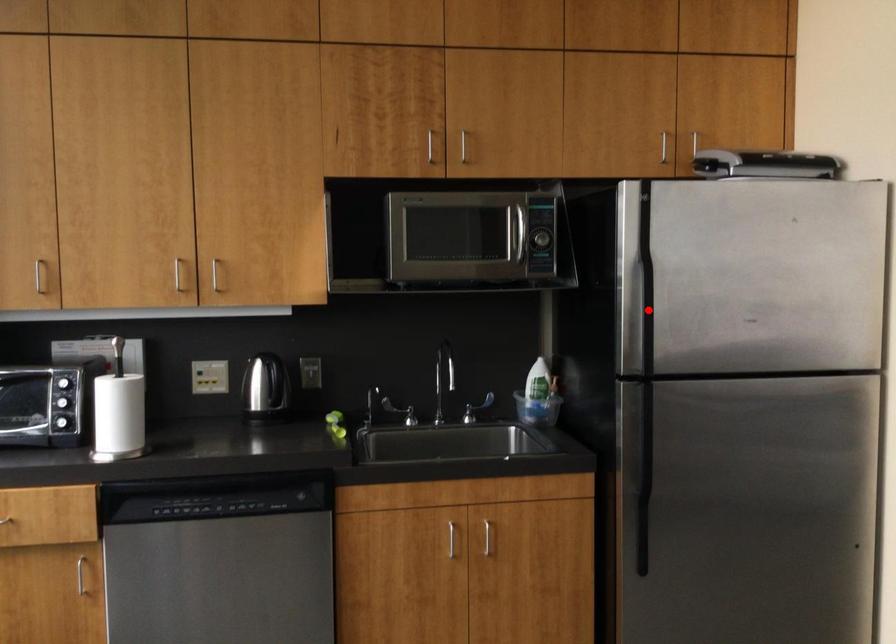
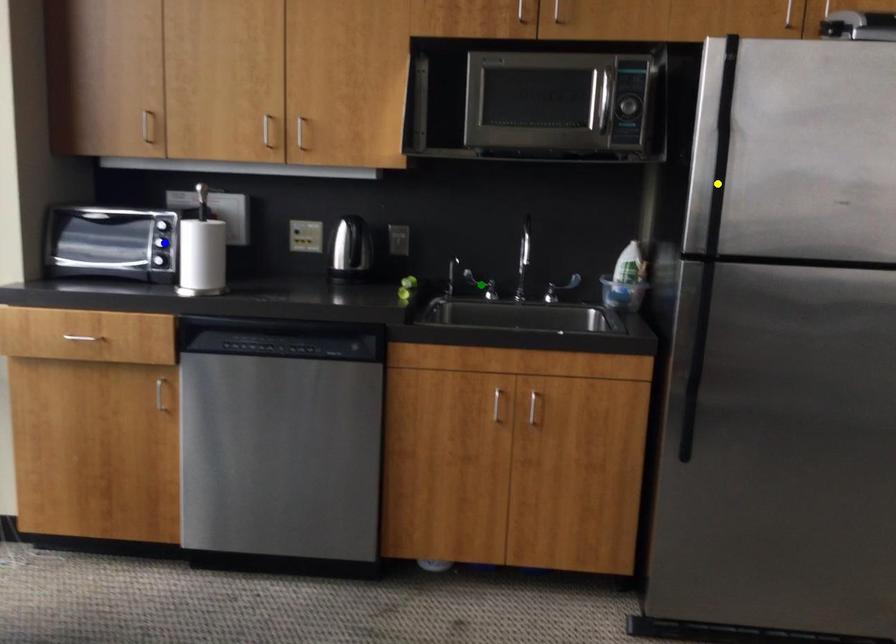
Question: I am providing you with two images of the same scene from different viewpoints. A red point is marked on the first image. You are given multiple points on the second image. Which spot in image 2 lines up with the point in image 1?

Choices:
 (A) green point
 (B) yellow point
 (C) blue point

Answer: (B)